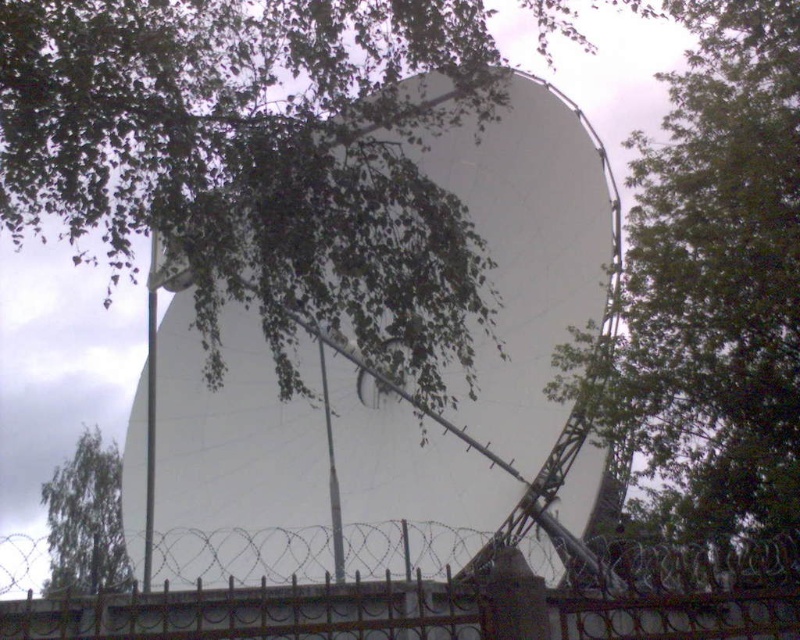
Can you confirm if white matte satellite at center is positioned above black wrought iron fence at center?

No.

Between white matte satellite at center and black wrought iron fence at center, which one appears on the left side from the viewer's perspective?

white matte satellite at center

Which is behind, point (426, 456) or point (772, 538)?

The point (426, 456) is more distant.

Image resolution: width=800 pixels, height=640 pixels. I want to click on white matte satellite at center, so coord(394,392).

Which is in front, point (798, 164) or point (612, 589)?

Positioned in front is point (612, 589).

Is point (706, 236) farther from camera compared to point (586, 612)?

Yes.

Locate an element on the screen. Image resolution: width=800 pixels, height=640 pixels. green leafy tree at upper right is located at coordinates (718, 278).

Who is positioned more to the left, black wrought iron fence at center or green leafy tree at upper left?

From the viewer's perspective, green leafy tree at upper left appears more on the left side.

Is the position of black wrought iron fence at center less distant than that of green leafy tree at upper left?

Yes, black wrought iron fence at center is closer to the viewer.

Measure the distance between point (426,636) and camera.

The distance of point (426,636) from camera is 19.10 feet.

Identify the location of black wrought iron fence at center. (460, 604).